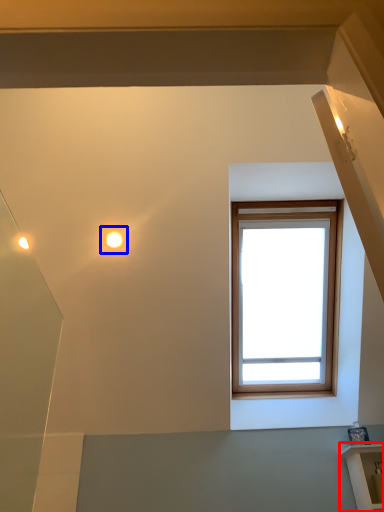
Question: Which point is closer to the camera, shelf (highlighted by a red box) or droplight (highlighted by a blue box)?

Choices:
 (A) shelf
 (B) droplight

Answer: (A)